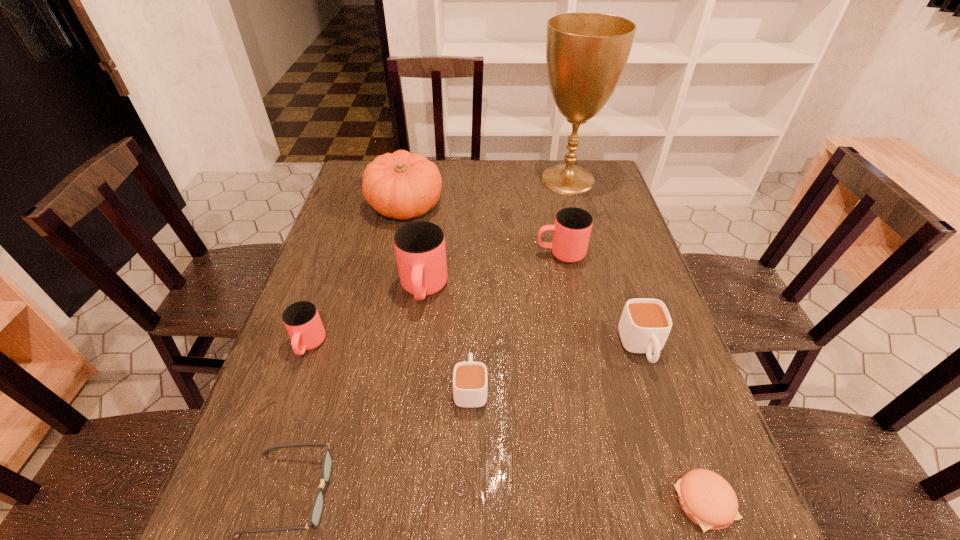
Where is `trophy cup`? The image size is (960, 540). trophy cup is located at coordinates (586, 52).

Locate an element on the screen. Image resolution: width=960 pixels, height=540 pixels. pumpkin is located at coordinates (401, 185).

Find the location of a particular element. the sixth nearest object is located at coordinates (420, 249).

Identify the location of the second pink cup from left to right. The image size is (960, 540). 420,249.

Identify the location of the rightmost pink cup. (571, 231).

The image size is (960, 540). What are the coordinates of `the farthest cup` in the screenshot? It's located at (571, 231).

The width and height of the screenshot is (960, 540). I want to click on the nearest pink cup, so click(301, 319).

Where is `the leftmost cup`? The width and height of the screenshot is (960, 540). the leftmost cup is located at coordinates (301, 319).

I want to click on the rightmost cup, so click(644, 326).

Identify the location of the bigger white cup. click(x=644, y=326).